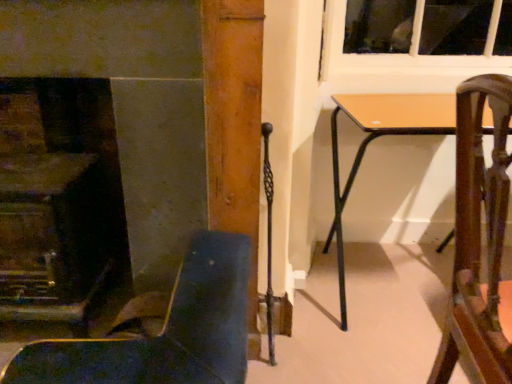
How much space does leather-like dark blue chair at lower left, placed as the second chair when sorted from right to left, occupy horizontally?

leather-like dark blue chair at lower left, placed as the second chair when sorted from right to left, is 21.28 inches in width.

Locate an element on the screen. This screenshot has width=512, height=384. light brown wooden table at center is located at coordinates (378, 137).

From a real-world perspective, is light brown wooden table at center under leather-like dark blue chair at lower left, placed as the second chair when sorted from right to left?

No, from a real-world perspective, light brown wooden table at center is not beneath leather-like dark blue chair at lower left, placed as the second chair when sorted from right to left.

Does light brown wooden table at center touch leather-like dark blue chair at lower left, marked as the 1th chair in a left-to-right arrangement?

light brown wooden table at center and leather-like dark blue chair at lower left, marked as the 1th chair in a left-to-right arrangement, are clearly separated.

Is light brown wooden table at center facing towards leather-like dark blue chair at lower left, marked as the 1th chair in a left-to-right arrangement?

No, light brown wooden table at center is not oriented towards leather-like dark blue chair at lower left, marked as the 1th chair in a left-to-right arrangement.

Considering the positions of objects light brown wooden table at center and leather-like dark blue chair at lower left, placed as the second chair when sorted from right to left, in the image provided, who is more to the right, light brown wooden table at center or leather-like dark blue chair at lower left, placed as the second chair when sorted from right to left,?

Positioned to the right is light brown wooden table at center.

From a real-world perspective, which object rests below the other?

Result: leather-like dark blue chair at lower left, marked as the 1th chair in a left-to-right arrangement, is physically lower.

Considering the relative sizes of leather-like dark blue chair at lower left, placed as the second chair when sorted from right to left, and light brown wooden table at center in the image provided, is leather-like dark blue chair at lower left, placed as the second chair when sorted from right to left, thinner than light brown wooden table at center?

Yes.

Looking at the image, does leather-like dark blue chair at lower left, marked as the 1th chair in a left-to-right arrangement, seem bigger or smaller compared to light brown wooden table at center?

Clearly, leather-like dark blue chair at lower left, marked as the 1th chair in a left-to-right arrangement, is smaller in size than light brown wooden table at center.

From the image's perspective, is leather-like dark blue chair at lower left, placed as the second chair when sorted from right to left, below light brown wooden table at center?

Yes.

Considering the points (461, 255) and (434, 94), which point is in front, point (461, 255) or point (434, 94)?

The point (461, 255) is more forward.

In the scene shown: From the image's perspective, which one is positioned higher, wooden chair at right, the second chair viewed from the left, or light brown wooden table at center?

light brown wooden table at center, from the image's perspective.

Which object is thinner, wooden chair at right, the second chair viewed from the left, or light brown wooden table at center?

wooden chair at right, the second chair viewed from the left.

From the image's perspective, count 1st chairs downward from the light brown wooden table at center and point to it. Please provide its 2D coordinates.

[(478, 235)]

Which of these two, wooden chair at right, placed as the first chair when sorted from right to left, or smooth stone fireplace at left, is wider?

wooden chair at right, placed as the first chair when sorted from right to left, is wider.

From the picture: Considering the relative sizes of wooden chair at right, placed as the first chair when sorted from right to left, and smooth stone fireplace at left in the image provided, is wooden chair at right, placed as the first chair when sorted from right to left, taller than smooth stone fireplace at left?

No.

Between wooden chair at right, the second chair viewed from the left, and smooth stone fireplace at left, which one has larger size?

Bigger between the two is wooden chair at right, the second chair viewed from the left.

Which is in front, point (360, 159) or point (33, 127)?

The point (33, 127) is in front.

Does light brown wooden table at center have a lesser width compared to smooth stone fireplace at left?

No.

From a real-world perspective, who is located higher, light brown wooden table at center or smooth stone fireplace at left?

smooth stone fireplace at left.

Is light brown wooden table at center oriented away from smooth stone fireplace at left?

No, light brown wooden table at center is not facing the opposite direction of smooth stone fireplace at left.

Is smooth stone fireplace at left at the back of leather-like dark blue chair at lower left, placed as the second chair when sorted from right to left?

Yes, leather-like dark blue chair at lower left, placed as the second chair when sorted from right to left, is positioned with its back facing smooth stone fireplace at left.

Is point (198, 253) behind point (170, 210)?

No.

Which is correct: leather-like dark blue chair at lower left, marked as the 1th chair in a left-to-right arrangement, is inside smooth stone fireplace at left, or outside of it?

leather-like dark blue chair at lower left, marked as the 1th chair in a left-to-right arrangement, is outside smooth stone fireplace at left.

Which is more distant, (x=77, y=84) or (x=495, y=184)?

The point (x=77, y=84) is more distant.

Is smooth stone fireplace at left to the right of wooden chair at right, placed as the first chair when sorted from right to left, from the viewer's perspective?

Incorrect, smooth stone fireplace at left is not on the right side of wooden chair at right, placed as the first chair when sorted from right to left.

Could you measure the distance between smooth stone fireplace at left and wooden chair at right, the second chair viewed from the left?

smooth stone fireplace at left is 3.93 feet from wooden chair at right, the second chair viewed from the left.

Is smooth stone fireplace at left facing towards wooden chair at right, the second chair viewed from the left?

No, smooth stone fireplace at left is not turned towards wooden chair at right, the second chair viewed from the left.

The image size is (512, 384). Identify the location of table on the right of leather-like dark blue chair at lower left, placed as the second chair when sorted from right to left. (378, 137).

At what (x,y) coordinates should I click in order to perform the action: click on chair that appears below the light brown wooden table at center (from a real-world perspective). Please return your answer as a coordinate pair (x, y). Looking at the image, I should click on (164, 331).

Which object lies nearer to the anchor point smooth stone fireplace at left, leather-like dark blue chair at lower left, placed as the second chair when sorted from right to left, or light brown wooden table at center?

Among the two, leather-like dark blue chair at lower left, placed as the second chair when sorted from right to left, is located nearer to smooth stone fireplace at left.

Estimate the real-world distances between objects in this image. Which object is closer to smooth stone fireplace at left, light brown wooden table at center or wooden chair at right, the second chair viewed from the left?

light brown wooden table at center is positioned closer to the anchor smooth stone fireplace at left.

Based on their spatial positions, is leather-like dark blue chair at lower left, marked as the 1th chair in a left-to-right arrangement, or light brown wooden table at center closer to wooden chair at right, the second chair viewed from the left?

leather-like dark blue chair at lower left, marked as the 1th chair in a left-to-right arrangement, is positioned closer to the anchor wooden chair at right, the second chair viewed from the left.

Considering their positions, is smooth stone fireplace at left positioned closer to wooden chair at right, the second chair viewed from the left, than light brown wooden table at center?

Among the two, light brown wooden table at center is located nearer to wooden chair at right, the second chair viewed from the left.

From the image, which object appears to be farther from light brown wooden table at center, wooden chair at right, the second chair viewed from the left, or smooth stone fireplace at left?

smooth stone fireplace at left.

Which object lies nearer to the anchor point light brown wooden table at center, wooden chair at right, placed as the first chair when sorted from right to left, or leather-like dark blue chair at lower left, marked as the 1th chair in a left-to-right arrangement?

wooden chair at right, placed as the first chair when sorted from right to left.

When comparing their distances from smooth stone fireplace at left, does light brown wooden table at center or leather-like dark blue chair at lower left, marked as the 1th chair in a left-to-right arrangement, seem further?

light brown wooden table at center lies further to smooth stone fireplace at left than the other object.

Estimate the real-world distances between objects in this image. Which object is further from leather-like dark blue chair at lower left, placed as the second chair when sorted from right to left, light brown wooden table at center or wooden chair at right, the second chair viewed from the left?

Based on the image, light brown wooden table at center appears to be further to leather-like dark blue chair at lower left, placed as the second chair when sorted from right to left.

The image size is (512, 384). Identify the location of chair situated between leather-like dark blue chair at lower left, placed as the second chair when sorted from right to left, and light brown wooden table at center from left to right. (478, 235).

Where is `chair between smooth stone fireplace at left and wooden chair at right, placed as the first chair when sorted from right to left, in the horizontal direction`? chair between smooth stone fireplace at left and wooden chair at right, placed as the first chair when sorted from right to left, in the horizontal direction is located at coordinates (164, 331).